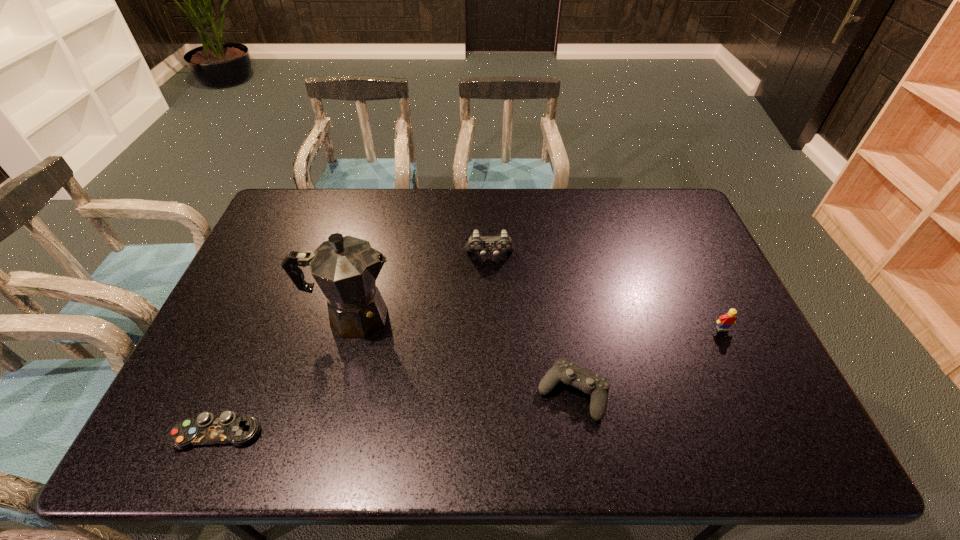
Find the location of `free spot that satisfies the following two spatial constraints: 1. on the surface of the second tallest object with buttons; 2. on the pouring side of the second object from left to right`. free spot that satisfies the following two spatial constraints: 1. on the surface of the second tallest object with buttons; 2. on the pouring side of the second object from left to right is located at coordinates (492, 317).